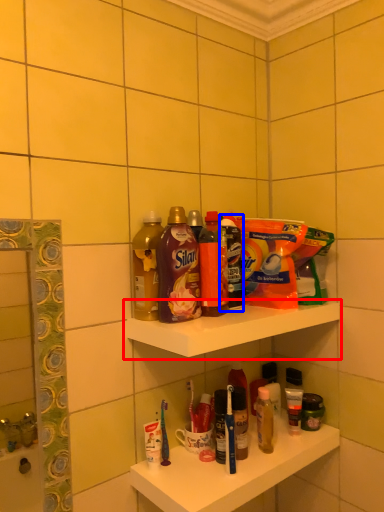
Question: Which object is closer to the camera taking this photo, shelf (highlighted by a red box) or cleaning product (highlighted by a blue box)?

Choices:
 (A) shelf
 (B) cleaning product

Answer: (A)